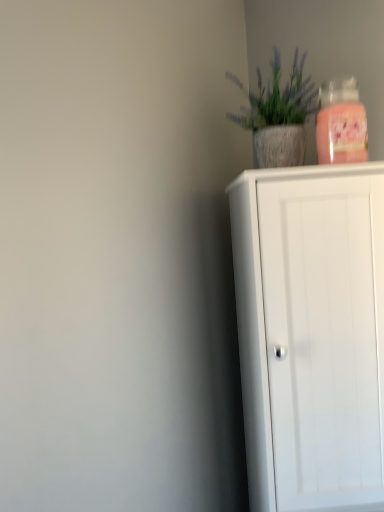
Question: Is white matte cabinet at right smaller than textured concrete pot at upper right?

Choices:
 (A) no
 (B) yes

Answer: (A)

Question: Is the position of white matte cabinet at right more distant than that of textured concrete pot at upper right?

Choices:
 (A) no
 (B) yes

Answer: (A)

Question: Is white matte cabinet at right thinner than textured concrete pot at upper right?

Choices:
 (A) yes
 (B) no

Answer: (B)

Question: Can you confirm if white matte cabinet at right is bigger than textured concrete pot at upper right?

Choices:
 (A) no
 (B) yes

Answer: (B)

Question: Is the depth of white matte cabinet at right less than that of textured concrete pot at upper right?

Choices:
 (A) no
 (B) yes

Answer: (B)

Question: Is white matte cabinet at right facing away from textured concrete pot at upper right?

Choices:
 (A) no
 (B) yes

Answer: (A)

Question: Is textured concrete pot at upper right to the left of white matte cabinet at right from the viewer's perspective?

Choices:
 (A) no
 (B) yes

Answer: (B)

Question: Is textured concrete pot at upper right wider than white matte cabinet at right?

Choices:
 (A) yes
 (B) no

Answer: (B)

Question: From the image's perspective, would you say textured concrete pot at upper right is shown under white matte cabinet at right?

Choices:
 (A) no
 (B) yes

Answer: (A)

Question: Can you confirm if textured concrete pot at upper right is positioned to the right of white matte cabinet at right?

Choices:
 (A) no
 (B) yes

Answer: (A)

Question: Is white matte cabinet at right inside textured concrete pot at upper right?

Choices:
 (A) yes
 (B) no

Answer: (B)

Question: Is textured concrete pot at upper right turned away from white matte cabinet at right?

Choices:
 (A) yes
 (B) no

Answer: (B)

Question: Is textured concrete pot at upper right wider or thinner than white matte cabinet at right?

Choices:
 (A) thin
 (B) wide

Answer: (A)